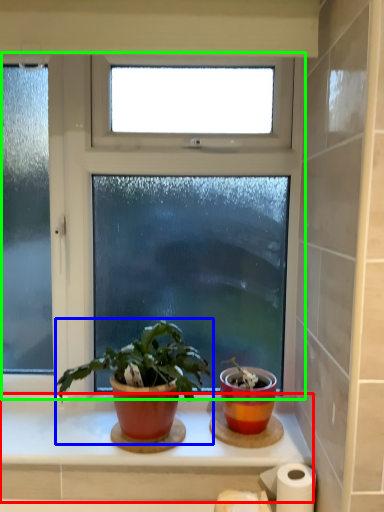
Question: Which object is positioned closest to window sill (highlighted by a red box)? Select from houseplant (highlighted by a blue box) and window (highlighted by a green box).

Choices:
 (A) houseplant
 (B) window

Answer: (A)